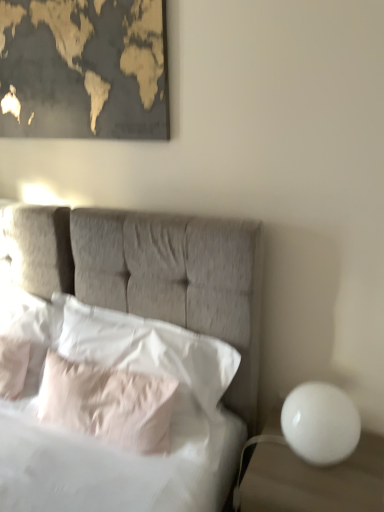
Where is `gold-toned matte map at upper left`? This screenshot has height=512, width=384. gold-toned matte map at upper left is located at coordinates (84, 69).

Do you think white soft pillow at left, which appears as the 3th pillow when viewed from the right, is within pale pink fabric pillow at center, which is counted as the third pillow, starting from the left, or outside of it?

white soft pillow at left, which appears as the 3th pillow when viewed from the right, is spatially situated outside pale pink fabric pillow at center, which is counted as the third pillow, starting from the left.

Is white soft pillow at left, which ranks as the second pillow in left-to-right order, wider than pale pink fabric pillow at center, the second pillow when ordered from right to left?

No, white soft pillow at left, which ranks as the second pillow in left-to-right order, is not wider than pale pink fabric pillow at center, the second pillow when ordered from right to left.

Considering the sizes of objects white soft pillow at left, which ranks as the second pillow in left-to-right order, and pale pink fabric pillow at center, the second pillow when ordered from right to left, in the image provided, who is bigger, white soft pillow at left, which ranks as the second pillow in left-to-right order, or pale pink fabric pillow at center, the second pillow when ordered from right to left,?

Bigger between the two is pale pink fabric pillow at center, the second pillow when ordered from right to left.

Is white soft pillow at left, which appears as the 3th pillow when viewed from the right, at the right side of pale pink fabric pillow at center, the second pillow when ordered from right to left?

Incorrect, white soft pillow at left, which appears as the 3th pillow when viewed from the right, is not on the right side of pale pink fabric pillow at center, the second pillow when ordered from right to left.

Considering the positions of objects white glossy sphere at right and pale pink fabric pillow at center, which is counted as the third pillow, starting from the left, in the image provided, who is more to the right, white glossy sphere at right or pale pink fabric pillow at center, which is counted as the third pillow, starting from the left,?

Positioned to the right is white glossy sphere at right.

Which object is further away from the camera, white glossy sphere at right or pale pink fabric pillow at center, the second pillow when ordered from right to left?

Positioned behind is pale pink fabric pillow at center, the second pillow when ordered from right to left.

From the image's perspective, which one is positioned lower, white glossy sphere at right or pale pink fabric pillow at center, the second pillow when ordered from right to left?

white glossy sphere at right is shown below in the image.

Where is `pillow that is the 2nd one when counting backward from the white glossy sphere at right`? The image size is (384, 512). pillow that is the 2nd one when counting backward from the white glossy sphere at right is located at coordinates (108, 403).

How many degrees apart are the facing directions of pale pink fabric pillow at center, the second pillow when ordered from right to left, and white glossy sphere at right?

The facing directions of pale pink fabric pillow at center, the second pillow when ordered from right to left, and white glossy sphere at right are 2.69 degrees apart.

Does pale pink fabric pillow at center, the second pillow when ordered from right to left, turn towards white glossy sphere at right?

No.

From their relative heights in the image, would you say pale pink fabric pillow at center, which is counted as the third pillow, starting from the left, is taller or shorter than white glossy sphere at right?

Clearly, pale pink fabric pillow at center, which is counted as the third pillow, starting from the left, is taller compared to white glossy sphere at right.

Identify the location of bedside lamp below the pale pink fabric pillow at center, which is counted as the third pillow, starting from the left (from the image's perspective). This screenshot has width=384, height=512. (320, 423).

Does white glossy sphere at right appear on the right side of white soft pillow at left, acting as the fourth pillow starting from the right?

Yes, white glossy sphere at right is to the right of white soft pillow at left, acting as the fourth pillow starting from the right.

Which is farther, (335,468) or (35,334)?

The point (35,334) is farther.

From a real-world perspective, which object stands above the other?

white soft pillow at left, positioned as the first pillow in left-to-right order.

Between white glossy sphere at right and white soft pillow at left, acting as the fourth pillow starting from the right, which one has less height?

With less height is white soft pillow at left, acting as the fourth pillow starting from the right.

Is point (1, 313) less distant than point (215, 390)?

No, it is behind (215, 390).

In the scene shown: Does white soft pillow at left, acting as the fourth pillow starting from the right, come behind white soft pillow at center, which appears as the 4th pillow when viewed from the left?

Yes, the depth of white soft pillow at left, acting as the fourth pillow starting from the right, is greater than that of white soft pillow at center, which appears as the 4th pillow when viewed from the left.

From a real-world perspective, who is located lower, white soft pillow at left, positioned as the first pillow in left-to-right order, or white soft pillow at center, the 1th pillow viewed from the right?

From a 3D spatial view, white soft pillow at center, the 1th pillow viewed from the right, is below.

Is white soft pillow at left, positioned as the first pillow in left-to-right order, not near white soft pillow at center, the 1th pillow viewed from the right?

No, there isn't a large distance between white soft pillow at left, positioned as the first pillow in left-to-right order, and white soft pillow at center, the 1th pillow viewed from the right.

Considering the positions of objects white soft pillow at center, the 1th pillow viewed from the right, and gold-toned matte map at upper left in the image provided, who is in front, white soft pillow at center, the 1th pillow viewed from the right, or gold-toned matte map at upper left?

white soft pillow at center, the 1th pillow viewed from the right.

Considering the sizes of objects white soft pillow at center, the 1th pillow viewed from the right, and gold-toned matte map at upper left in the image provided, who is taller, white soft pillow at center, the 1th pillow viewed from the right, or gold-toned matte map at upper left?

With more height is gold-toned matte map at upper left.

Considering the sizes of white soft pillow at center, the 1th pillow viewed from the right, and gold-toned matte map at upper left in the image, is white soft pillow at center, the 1th pillow viewed from the right, bigger or smaller than gold-toned matte map at upper left?

white soft pillow at center, the 1th pillow viewed from the right, is bigger than gold-toned matte map at upper left.

Are white soft pillow at center, the 1th pillow viewed from the right, and gold-toned matte map at upper left far apart?

They are positioned close to each other.

Between white soft pillow at left, positioned as the first pillow in left-to-right order, and gold-toned matte map at upper left, which one has smaller width?

gold-toned matte map at upper left is thinner.

Is white soft pillow at left, acting as the fourth pillow starting from the right, located outside gold-toned matte map at upper left?

Yes.

What's the angular difference between white soft pillow at left, positioned as the first pillow in left-to-right order, and gold-toned matte map at upper left's facing directions?

The angle between the facing direction of white soft pillow at left, positioned as the first pillow in left-to-right order, and the facing direction of gold-toned matte map at upper left is 1.66 degrees.

Between white soft pillow at left, positioned as the first pillow in left-to-right order, and gold-toned matte map at upper left, which one appears on the right side from the viewer's perspective?

From the viewer's perspective, gold-toned matte map at upper left appears more on the right side.

From the image's perspective, count 1st pillows upward from the pale pink fabric pillow at center, which is counted as the third pillow, starting from the left, and point to it. Please provide its 2D coordinates.

[(13, 366)]

In the image, there is a pale pink fabric pillow at center, which is counted as the third pillow, starting from the left. Where is `nightstand below it (from the image's perspective)`? This screenshot has width=384, height=512. nightstand below it (from the image's perspective) is located at coordinates pyautogui.click(x=314, y=480).

Looking at the image, which one is located closer to white glossy sphere at right, gold-toned matte map at upper left or white soft pillow at left, acting as the fourth pillow starting from the right?

Among the two, white soft pillow at left, acting as the fourth pillow starting from the right, is located nearer to white glossy sphere at right.

Which object lies further to the anchor point white soft pillow at left, acting as the fourth pillow starting from the right, white soft pillow at center, which appears as the 4th pillow when viewed from the left, or white glossy sphere at right?

white glossy sphere at right.

Based on the photo, estimate the real-world distances between objects in this image. Which object is closer to gold-toned matte map at upper left, white soft pillow at left, which ranks as the second pillow in left-to-right order, or white soft pillow at left, positioned as the first pillow in left-to-right order?

white soft pillow at left, positioned as the first pillow in left-to-right order, lies closer to gold-toned matte map at upper left than the other object.

Looking at the image, which one is located further to white soft pillow at center, which appears as the 4th pillow when viewed from the left, white glossy sphere at right or gold-toned matte map at upper left?

gold-toned matte map at upper left.

Which object lies nearer to the anchor point pale pink fabric pillow at center, the second pillow when ordered from right to left, white soft pillow at left, which ranks as the second pillow in left-to-right order, or white soft pillow at center, the 1th pillow viewed from the right?

white soft pillow at center, the 1th pillow viewed from the right, lies closer to pale pink fabric pillow at center, the second pillow when ordered from right to left, than the other object.

Estimate the real-world distances between objects in this image. Which object is closer to white soft pillow at center, the 1th pillow viewed from the right, pale pink fabric pillow at center, which is counted as the third pillow, starting from the left, or gold-toned matte map at upper left?

pale pink fabric pillow at center, which is counted as the third pillow, starting from the left, lies closer to white soft pillow at center, the 1th pillow viewed from the right, than the other object.

When comparing their distances from pale pink fabric pillow at center, the second pillow when ordered from right to left, does white glossy sphere at right or white glossy sphere at right seem further?

white glossy sphere at right.

Looking at the image, which one is located further to white glossy sphere at right, white soft pillow at center, which appears as the 4th pillow when viewed from the left, or white soft pillow at left, acting as the fourth pillow starting from the right?

Based on the image, white soft pillow at left, acting as the fourth pillow starting from the right, appears to be further to white glossy sphere at right.

Find the location of `pillow between pale pink fabric pillow at center, the second pillow when ordered from right to left, and white glossy sphere at right from left to right`. pillow between pale pink fabric pillow at center, the second pillow when ordered from right to left, and white glossy sphere at right from left to right is located at coordinates (144, 348).

Where is `bedside lamp between gold-toned matte map at upper left and white glossy sphere at right from top to bottom`? bedside lamp between gold-toned matte map at upper left and white glossy sphere at right from top to bottom is located at coordinates (320, 423).

You are a GUI agent. You are given a task and a screenshot of the screen. Output one action in this format:
    pyautogui.click(x=<x>, y=<y>)
    Task: Click on the pillow between pale pink fabric pillow at center, the second pillow when ordered from right to left, and white glossy sphere at right
    Image resolution: width=384 pixels, height=512 pixels.
    Given the screenshot: What is the action you would take?
    pyautogui.click(x=144, y=348)

Where is `nightstand situated between white soft pillow at center, which appears as the 4th pillow when viewed from the left, and white glossy sphere at right from left to right`? nightstand situated between white soft pillow at center, which appears as the 4th pillow when viewed from the left, and white glossy sphere at right from left to right is located at coordinates (314, 480).